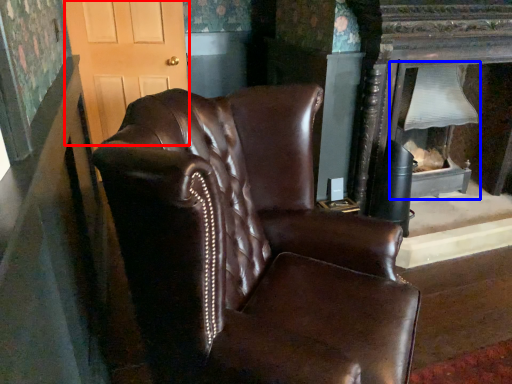
Question: Among these objects, which one is nearest to the camera, glass door (highlighted by a red box) or fireplace (highlighted by a blue box)?

Choices:
 (A) glass door
 (B) fireplace

Answer: (B)